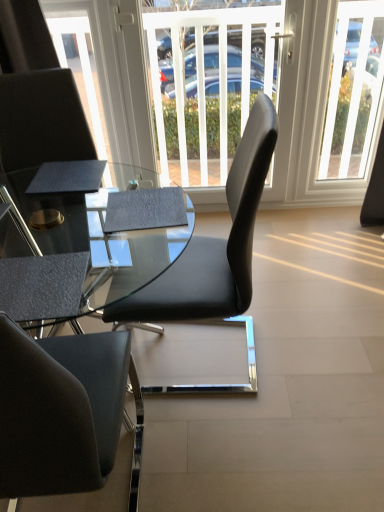
Image resolution: width=384 pixels, height=512 pixels. In order to click on vacant area that lies to the right of matte black glass table at center in this screenshot , I will do `click(296, 381)`.